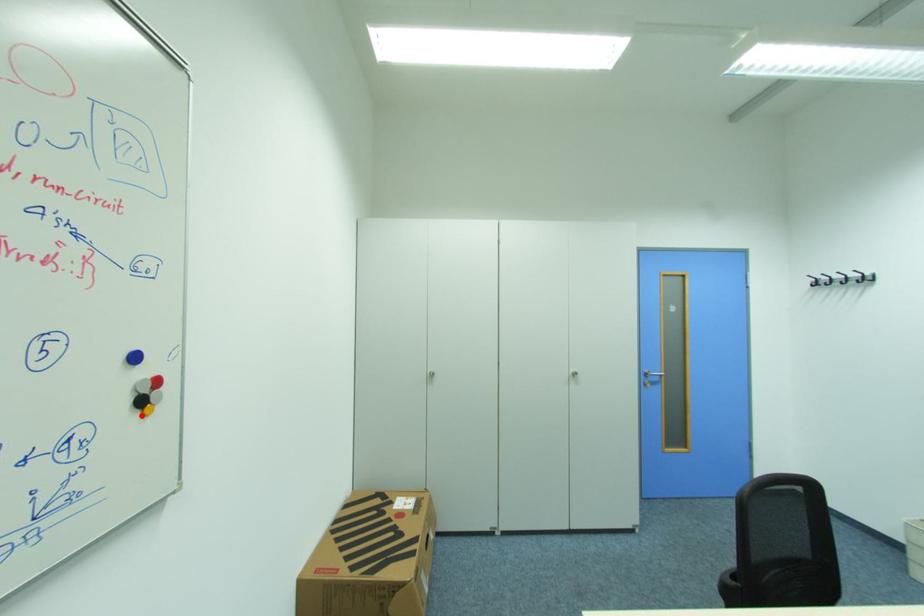
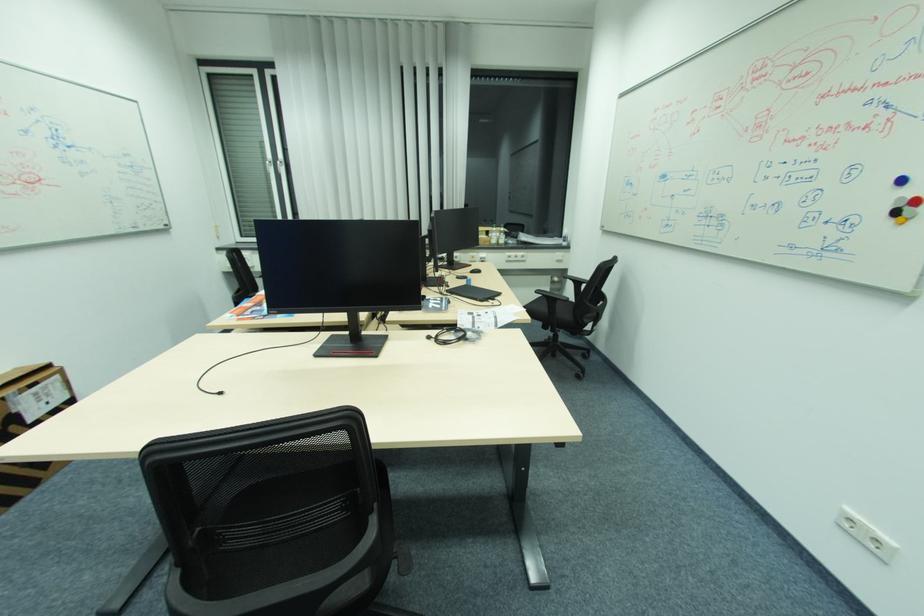
Question: I am providing you with two images of the same scene from different viewpoints. A red point is marked on the first image. Is the red point's position out of view in image 2?

Choices:
 (A) Yes
 (B) No

Answer: (B)